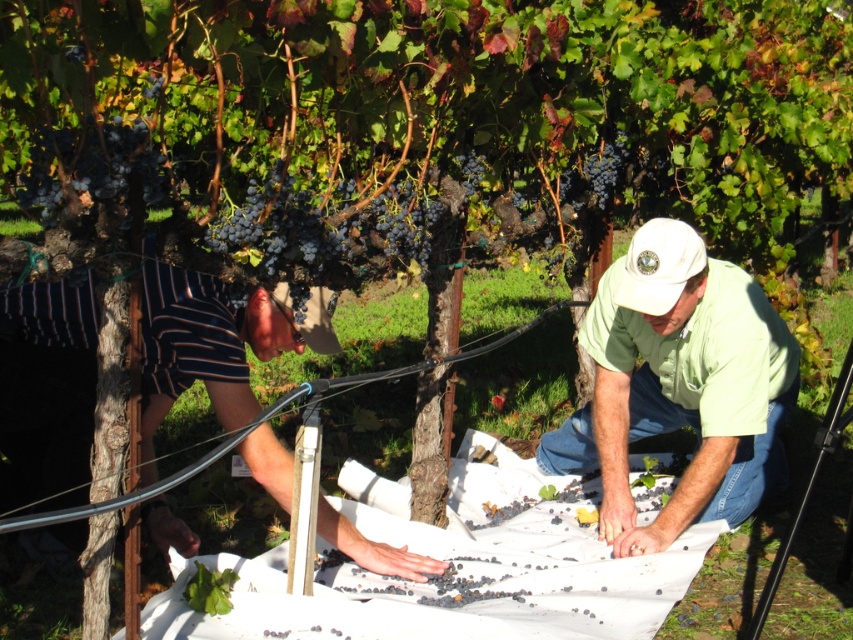
Question: Among these points, which one is farthest from the camera?

Choices:
 (A) (143, 90)
 (B) (328, 518)
 (C) (99, 138)
 (D) (778, 340)

Answer: (D)

Question: Which object appears farthest from the camera in this image?

Choices:
 (A) dark purple grapes at upper center
 (B) ripe dark purple grapes at upper left

Answer: (A)

Question: Can you confirm if green matte shirt at center is bigger than dark purple grapes at center?

Choices:
 (A) yes
 (B) no

Answer: (A)

Question: Does ripe dark purple grapes at upper left have a lesser width compared to dark purple grapes at center?

Choices:
 (A) no
 (B) yes

Answer: (A)

Question: Which is farther from the ripe dark purple grapes at upper left?

Choices:
 (A) striped cotton shorts at lower left
 (B) dark purple grapes at upper center
 (C) green matte shirt at center

Answer: (B)

Question: From the image, what is the correct spatial relationship of ripe dark purple grapes at upper left in relation to dark purple grapes at upper center?

Choices:
 (A) right
 (B) left

Answer: (B)